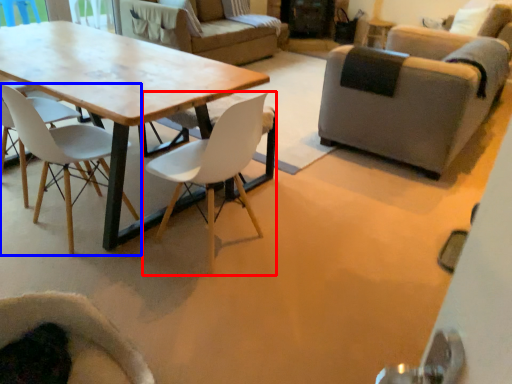
Question: Which point is closer to the camera, chair (highlighted by a red box) or chair (highlighted by a blue box)?

Choices:
 (A) chair
 (B) chair

Answer: (A)